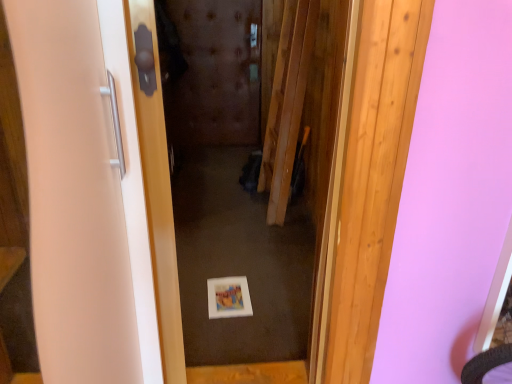
Question: Considering the positions of white glossy door at center, the first door positioned from the right, and white glossy door handle at left, positioned as the second door in right-to-left order, in the image, is white glossy door at center, the first door positioned from the right, bigger or smaller than white glossy door handle at left, positioned as the second door in right-to-left order,?

Choices:
 (A) small
 (B) big

Answer: (B)

Question: From a real-world perspective, is white glossy door at center, the 2th door positioned from the left, positioned above or below white glossy door handle at left, positioned as the second door in right-to-left order?

Choices:
 (A) below
 (B) above

Answer: (A)

Question: Is white glossy door at center, the first door positioned from the right, in front of or behind white glossy door handle at left, placed as the 1th door when sorted from left to right, in the image?

Choices:
 (A) front
 (B) behind

Answer: (B)

Question: Looking at their shapes, would you say white glossy door handle at left, placed as the 1th door when sorted from left to right, is wider or thinner than white glossy door at center, the 2th door positioned from the left?

Choices:
 (A) wide
 (B) thin

Answer: (A)

Question: Is white glossy door handle at left, placed as the 1th door when sorted from left to right, taller or shorter than white glossy door at center, the 2th door positioned from the left?

Choices:
 (A) tall
 (B) short

Answer: (B)

Question: From a real-world perspective, is white glossy door handle at left, positioned as the second door in right-to-left order, above or below white glossy door at center, the 2th door positioned from the left?

Choices:
 (A) below
 (B) above

Answer: (B)

Question: In terms of size, does white glossy door handle at left, positioned as the second door in right-to-left order, appear bigger or smaller than white glossy door at center, the 2th door positioned from the left?

Choices:
 (A) small
 (B) big

Answer: (A)